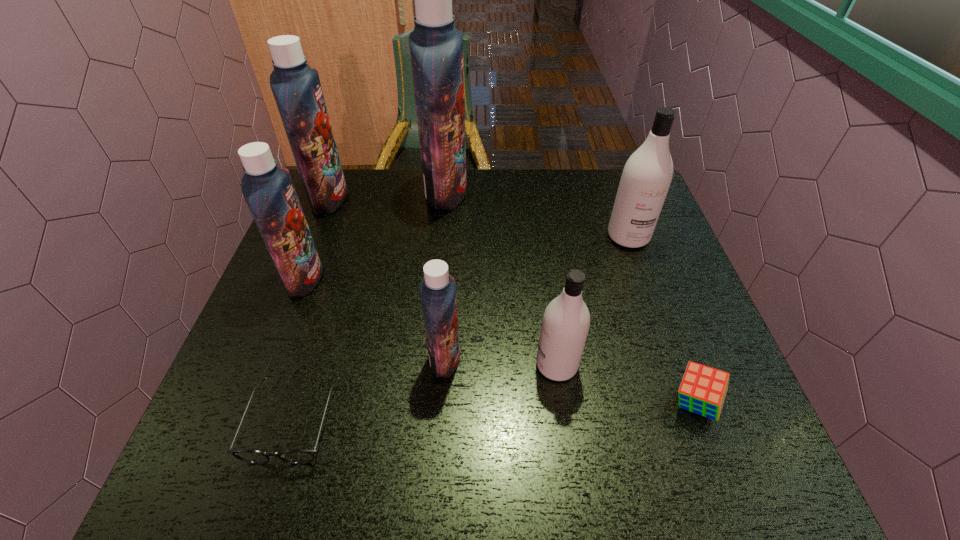
I want to click on the nearer white shampoo, so click(x=566, y=320).

Where is `red cube`? The width and height of the screenshot is (960, 540). red cube is located at coordinates (703, 389).

Find the location of a particular element. the second shortest object is located at coordinates (703, 389).

Where is `spectacles`? This screenshot has width=960, height=540. spectacles is located at coordinates (298, 456).

I want to click on black spectacles, so click(298, 456).

I want to click on vacant position located on the front label of the tallest object, so click(x=561, y=192).

Identify the location of vacant space located 0.270m on the front label of the fifth shortest shampoo. The image size is (960, 540). (437, 199).

I want to click on vacant region located 0.360m on the front label of the third nearest shampoo, so click(x=466, y=278).

The width and height of the screenshot is (960, 540). Identify the location of blank area located on the front-facing side of the bigger white shampoo. (669, 351).

I want to click on vacant space positioned on the front label of the nearest blue shampoo, so click(614, 358).